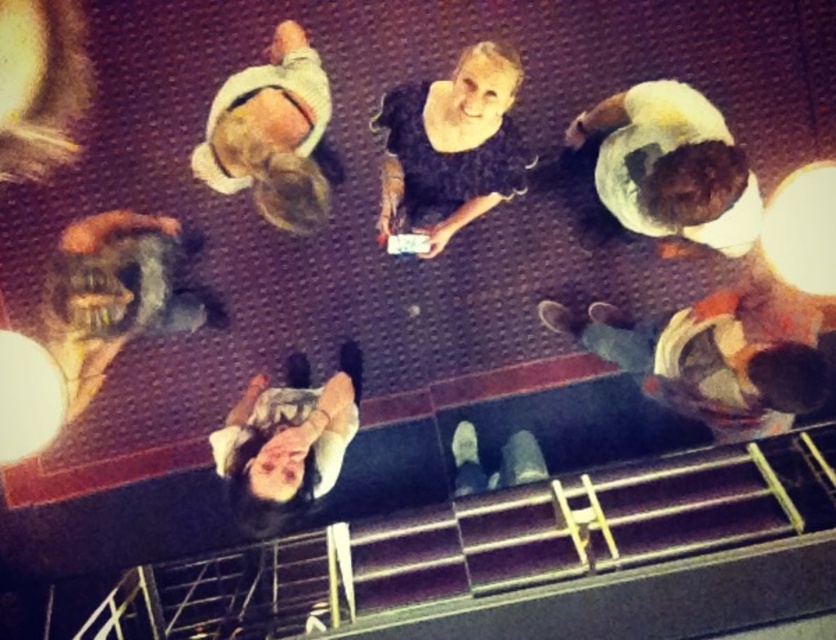
You are standing in front of the stage and see the orange fabric shirt at right and the smooth white shirt at lower center. Which shirt is closer to you?

The orange fabric shirt at right is closer to you because it is further to the viewer than the smooth white shirt at lower center.

From the picture: You are a photographer trying to capture a closeup of the orange fabric shirt at right and the smooth white shirt at lower center. Since you want both shirts to be clearly visible, which shirt should you focus on first to ensure it appears sharp in the photo?

The orange fabric shirt at right is bigger than the smooth white shirt at lower center, so you should focus on the orange fabric shirt at right first to ensure it appears sharp in the photo.

You are standing above the stage and looking down. You see the orange fabric shirt at right and the white cotton shirt at upper left. Which shirt is closer to the bottom edge of the stage?

The orange fabric shirt at right is located below the white cotton shirt at upper left, so it is closer to the bottom edge of the stage.